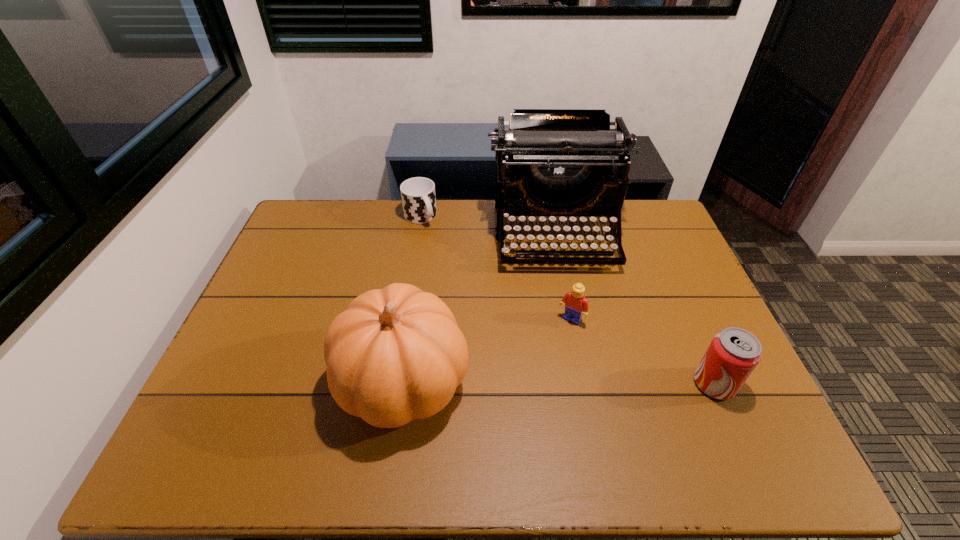
Locate an element on the screen. The image size is (960, 540). soda can at the near edge is located at coordinates (734, 353).

This screenshot has height=540, width=960. Identify the location of object present at the right edge. (734, 353).

The height and width of the screenshot is (540, 960). What are the coordinates of `object located in the near right corner section of the desktop` in the screenshot? It's located at (734, 353).

This screenshot has width=960, height=540. I want to click on free location at the far edge, so (362, 213).

Locate an element on the screen. This screenshot has height=540, width=960. vacant space at the near edge of the desktop is located at coordinates (480, 393).

Locate an element on the screen. vacant space at the left edge is located at coordinates (305, 298).

This screenshot has width=960, height=540. In the image, there is a desktop. Find the location of `free space at the right edge`. free space at the right edge is located at coordinates (674, 309).

I want to click on free space at the far left corner of the desktop, so click(297, 230).

At what (x,y) coordinates should I click in order to perform the action: click on vacant space at the far right corner of the desktop. Please return your answer as a coordinate pair (x, y). Looking at the image, I should click on (639, 232).

The width and height of the screenshot is (960, 540). I want to click on free space between the third nearest object and the second tallest object, so click(488, 351).